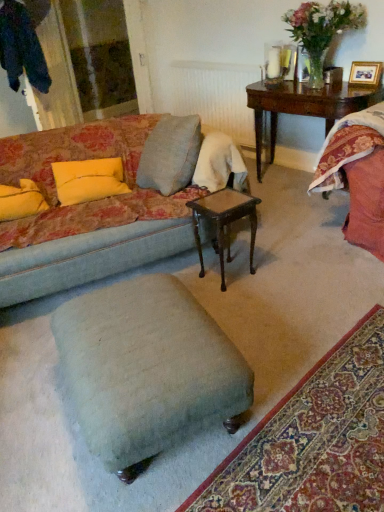
Question: From a real-world perspective, is velvet teal ottoman at lower center below wooden picture frame at upper right?

Choices:
 (A) no
 (B) yes

Answer: (B)

Question: Is velvet teal ottoman at lower center at the right side of wooden picture frame at upper right?

Choices:
 (A) yes
 (B) no

Answer: (B)

Question: Can we say velvet teal ottoman at lower center lies outside wooden picture frame at upper right?

Choices:
 (A) yes
 (B) no

Answer: (A)

Question: Is velvet teal ottoman at lower center oriented towards wooden picture frame at upper right?

Choices:
 (A) no
 (B) yes

Answer: (A)

Question: Can wooden picture frame at upper right be found inside velvet teal ottoman at lower center?

Choices:
 (A) yes
 (B) no

Answer: (B)

Question: Would you say velvet teal ottoman at lower center is a long distance from wooden picture frame at upper right?

Choices:
 (A) yes
 (B) no

Answer: (A)

Question: Is wooden picture frame at upper right not within dark wood side table at upper right?

Choices:
 (A) no
 (B) yes

Answer: (B)

Question: Is wooden picture frame at upper right looking in the opposite direction of dark wood side table at upper right?

Choices:
 (A) yes
 (B) no

Answer: (B)

Question: Is wooden picture frame at upper right aimed at dark wood side table at upper right?

Choices:
 (A) yes
 (B) no

Answer: (B)

Question: Can you confirm if wooden picture frame at upper right is thinner than dark wood side table at upper right?

Choices:
 (A) no
 (B) yes

Answer: (B)

Question: Considering the relative sizes of wooden picture frame at upper right and dark wood side table at upper right in the image provided, is wooden picture frame at upper right wider than dark wood side table at upper right?

Choices:
 (A) no
 (B) yes

Answer: (A)

Question: Is the surface of wooden picture frame at upper right in direct contact with dark wood side table at upper right?

Choices:
 (A) no
 (B) yes

Answer: (A)

Question: Are velvet teal ottoman at lower center and yellow fabric pillow at left, which is counted as the first pillow, starting from the right, located far from each other?

Choices:
 (A) no
 (B) yes

Answer: (B)